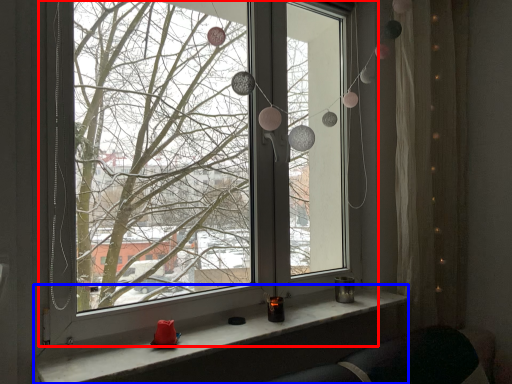
Question: Which object appears closest to the camera in this image, window (highlighted by a red box) or window sill (highlighted by a blue box)?

Choices:
 (A) window
 (B) window sill

Answer: (B)